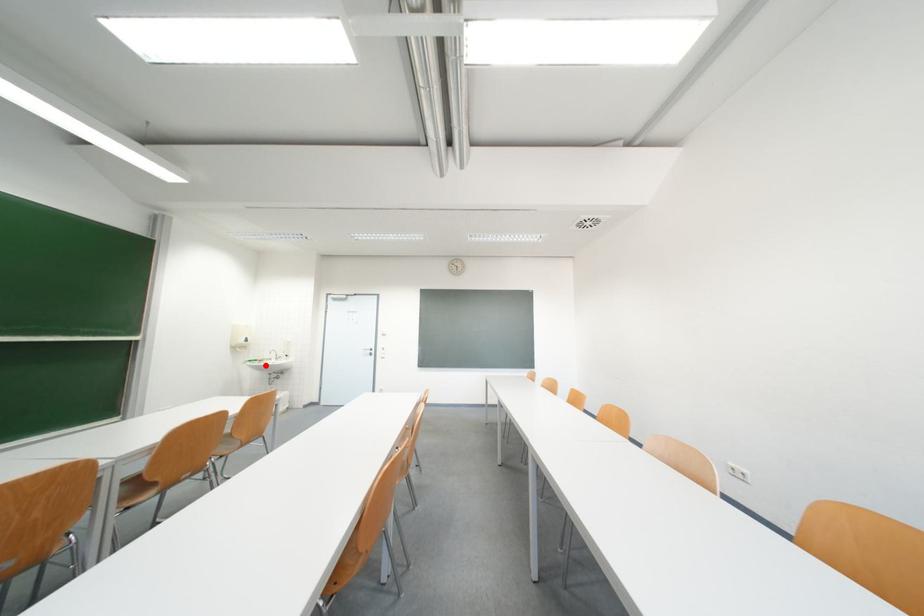
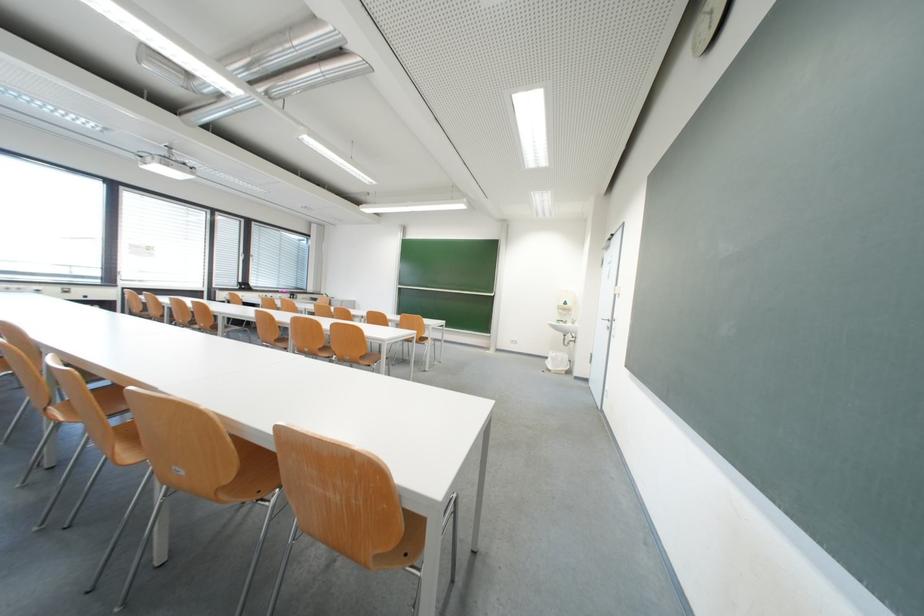
Where in the second image is the point corresponding to the highlighted location from the first image?

(570, 326)